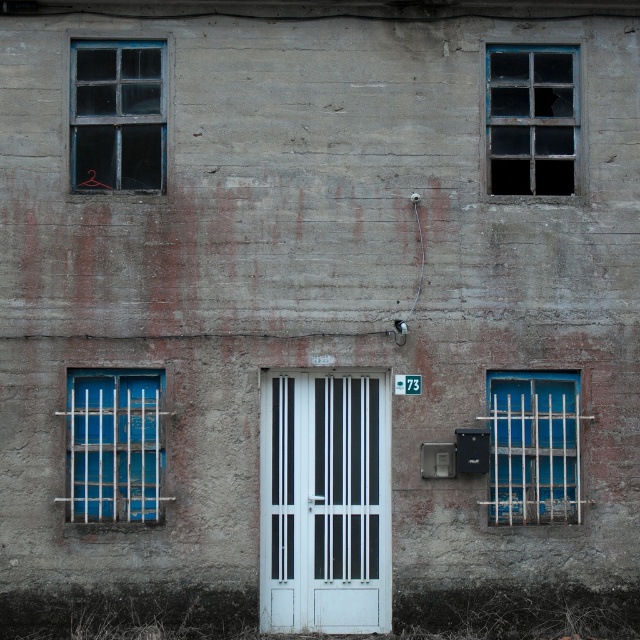
You are standing 30 feet away from the building facade. A point at coordinates point (x=80, y=125) is marked on the wall. Can you reach this point with a 40 feet long pole?

The distance of point (x=80, y=125) from viewer is 39.00 feet. Since the pole is 40 feet long, you can just barely reach the point with the pole.

You are a painter assessing the building facade. You need to determine which object requires less ladder height to reach between the blue painted metal bars at right and the transparent glass window at upper right. Which one?

The blue painted metal bars at right has a lesser height compared to the transparent glass window at upper right, so the blue painted metal bars at right requires less ladder height to reach.

Looking at this image, you are a delivery person trying to deliver a package to the building. The door is locked, and you need to locate the intercom. The intercom is installed on the object that is smaller between the white glossy door at center and the transparent glass window at upper right. Which object should you look near?

The intercom is installed on the transparent glass window at upper right because it is smaller than the white glossy door at center.